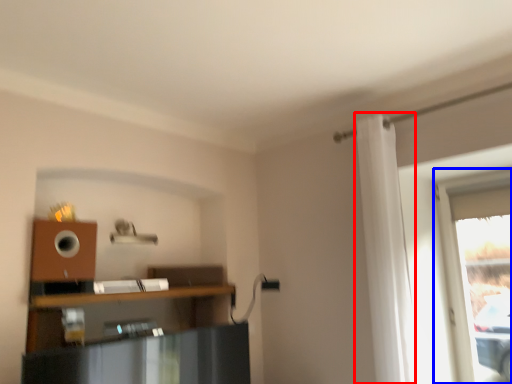
Question: Which object appears farthest to the camera in this image, curtain (highlighted by a red box) or window (highlighted by a blue box)?

Choices:
 (A) curtain
 (B) window

Answer: (B)